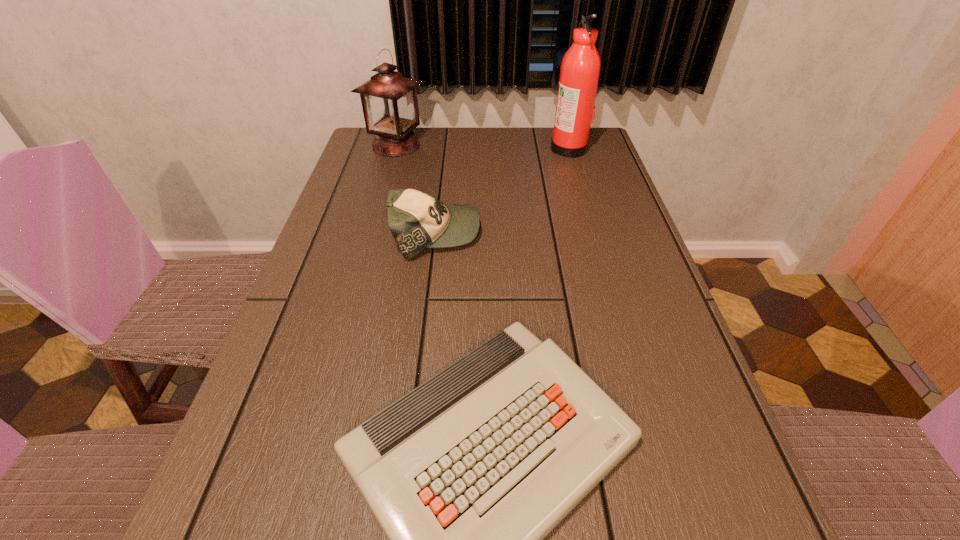
I want to click on free space between the tallest object and the second nearest object, so click(x=502, y=191).

Locate an element on the screen. free space that is in between the third tallest object and the oil lamp is located at coordinates pos(416,190).

Identify the location of vacant space that is in between the second nearest object and the third shortest object. (416, 190).

This screenshot has height=540, width=960. What are the coordinates of `the second closest object relative to the shortest object` in the screenshot? It's located at (389, 101).

Select which object is the second closest to the baseball cap. Please provide its 2D coordinates. Your answer should be formatted as a tuple, i.e. [(x, y)], where the tuple contains the x and y coordinates of a point satisfying the conditions above.

[(389, 101)]